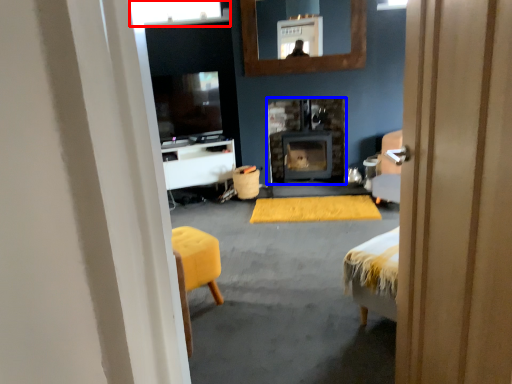
Question: Which object appears farthest to the camera in this image, window (highlighted by a red box) or wood burning stove (highlighted by a blue box)?

Choices:
 (A) window
 (B) wood burning stove

Answer: (A)